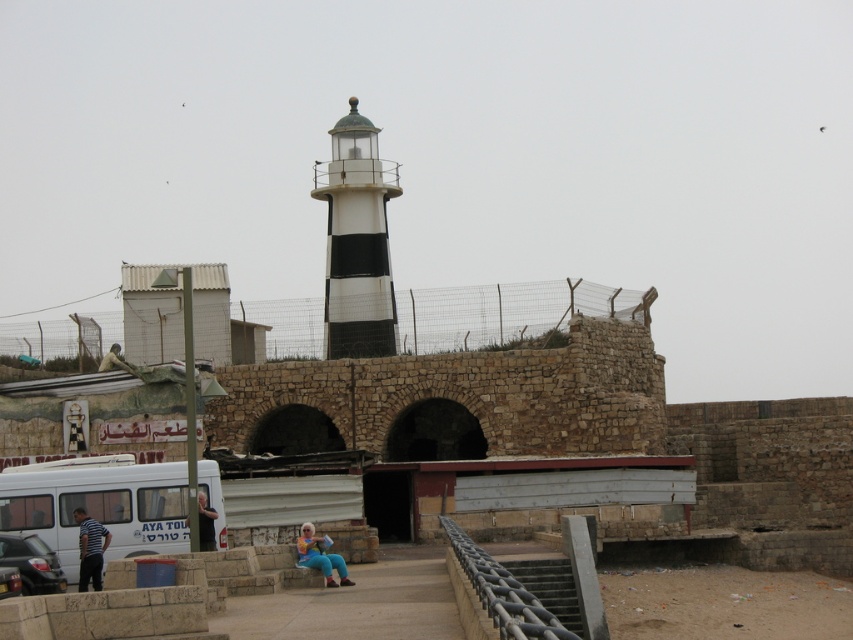
You are standing at the point labeled point (97, 589) and want to walk towards the lighthouse. Is the point labeled point (537, 568) located behind you or in front of you as you face the lighthouse?

The point labeled point (537, 568) is behind point (97, 589). Since you are facing the lighthouse, the point (537, 568) would be behind you.

From the picture: You are a tour guide who needs to ensure that the white matte van at lower left can pass under a low bridge that is only as tall as the blue jeans at lower center. Based on the scene, will the van clear the bridge?

The white matte van at lower left is much taller than the blue jeans at lower center, so it will not clear the bridge that is only as tall as the blue jeans at lower center.

You are a tour guide who needs to ensure that the white matte van at lower left can move forward without hitting the pastel blue jeans at center. Based on the scene, can the van safely move forward?

The white matte van at lower left is positioned over pastel blue jeans at center, meaning the van is directly above the jeans. Since the jeans are at the center, moving the van forward would require checking the space between them. However, the description states the van is over the jeans, suggesting they are in the same area. Therefore, moving the van forward might risk hitting the jeans unless there is enough clearance. The answer depends on spatial arrangement not fully detailed here, but based on given,